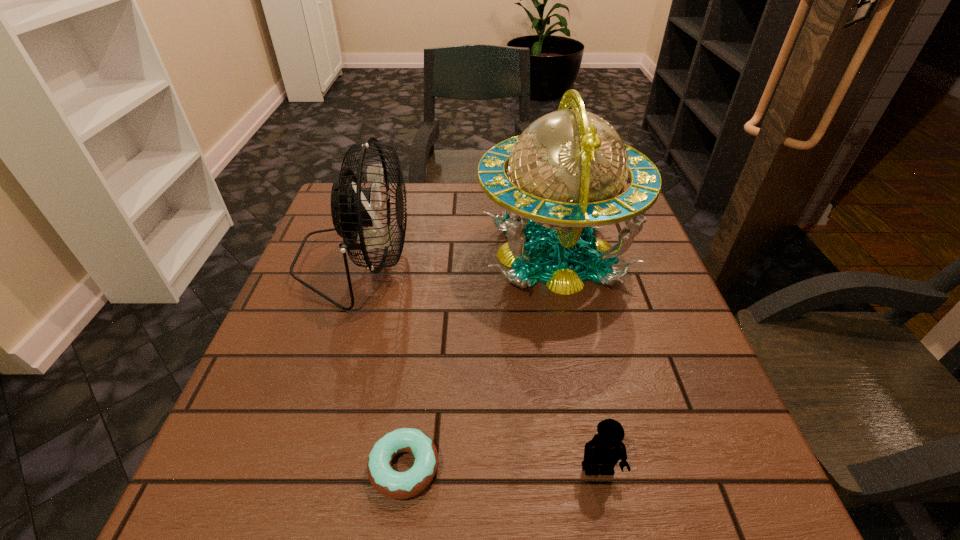
At what (x,y) coordinates should I click in order to perform the action: click on object that stands as the second closest to the globe. Please return your answer as a coordinate pair (x, y). The width and height of the screenshot is (960, 540). Looking at the image, I should click on (396, 485).

Select which object is the closest to the third tallest object. Please provide its 2D coordinates. Your answer should be formatted as a tuple, i.e. [(x, y)], where the tuple contains the x and y coordinates of a point satisfying the conditions above.

[(396, 485)]

You are a GUI agent. You are given a task and a screenshot of the screen. Output one action in this format:
    pyautogui.click(x=<x>, y=<y>)
    Task: Click on the free point that satisfies the following two spatial constraints: 1. on the back side of the doughnut; 2. on the right side of the tallest object
    The height and width of the screenshot is (540, 960).
    Given the screenshot: What is the action you would take?
    pyautogui.click(x=432, y=254)

At what (x,y) coordinates should I click in order to perform the action: click on free location that satisfies the following two spatial constraints: 1. in front of the shortest object, directing airflow; 2. on the right side of the third shortest object. Please return your answer as a coordinate pair (x, y). Looking at the image, I should click on (289, 468).

You are a GUI agent. You are given a task and a screenshot of the screen. Output one action in this format:
    pyautogui.click(x=<x>, y=<y>)
    Task: Click on the free spot that satisfies the following two spatial constraints: 1. in front of the shortest object, directing airflow; 2. on the right side of the fan
    This screenshot has height=540, width=960.
    Given the screenshot: What is the action you would take?
    pyautogui.click(x=289, y=468)

Locate an element on the screen. The width and height of the screenshot is (960, 540). vacant region that satisfies the following two spatial constraints: 1. in front of the doughnut, directing airflow; 2. on the left side of the fan is located at coordinates (289, 468).